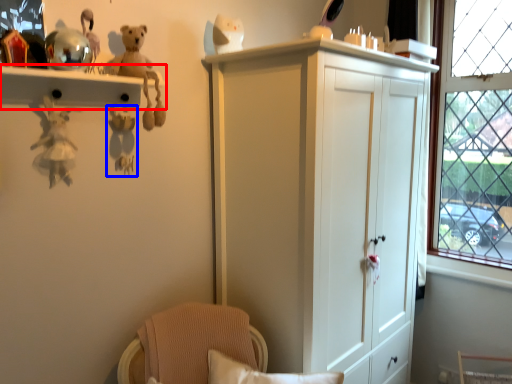
Question: Which of the following is the closest to the observer, shelf (highlighted by a red box) or toy (highlighted by a blue box)?

Choices:
 (A) shelf
 (B) toy

Answer: (A)